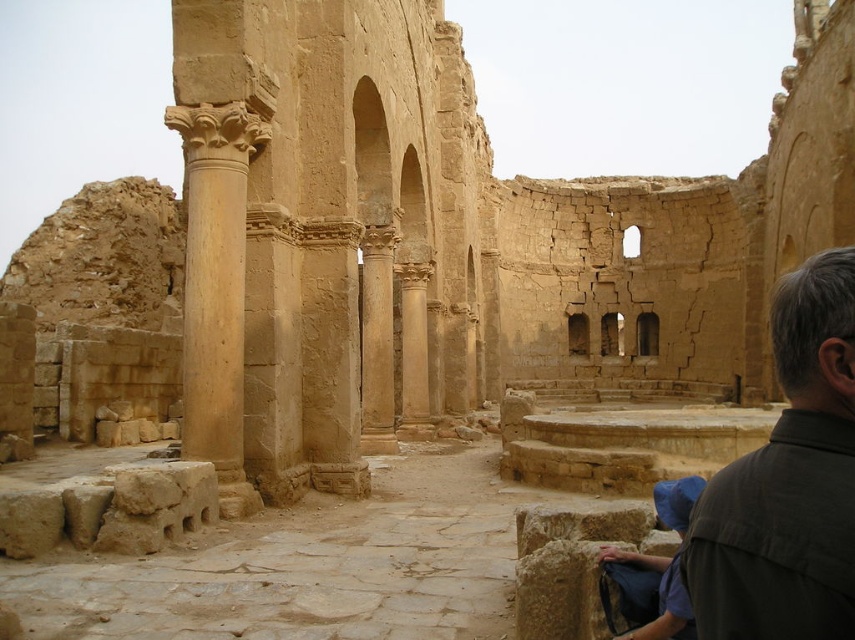
Can you confirm if dark brown shirt at lower right is bigger than smooth sandstone column at center-left?

Indeed, dark brown shirt at lower right has a larger size compared to smooth sandstone column at center-left.

Is dark brown shirt at lower right thinner than smooth sandstone column at center-left?

In fact, dark brown shirt at lower right might be wider than smooth sandstone column at center-left.

At what (x,y) coordinates should I click in order to perform the action: click on dark brown shirt at lower right. Please return your answer as a coordinate pair (x, y). This screenshot has height=640, width=855. Looking at the image, I should click on (788, 483).